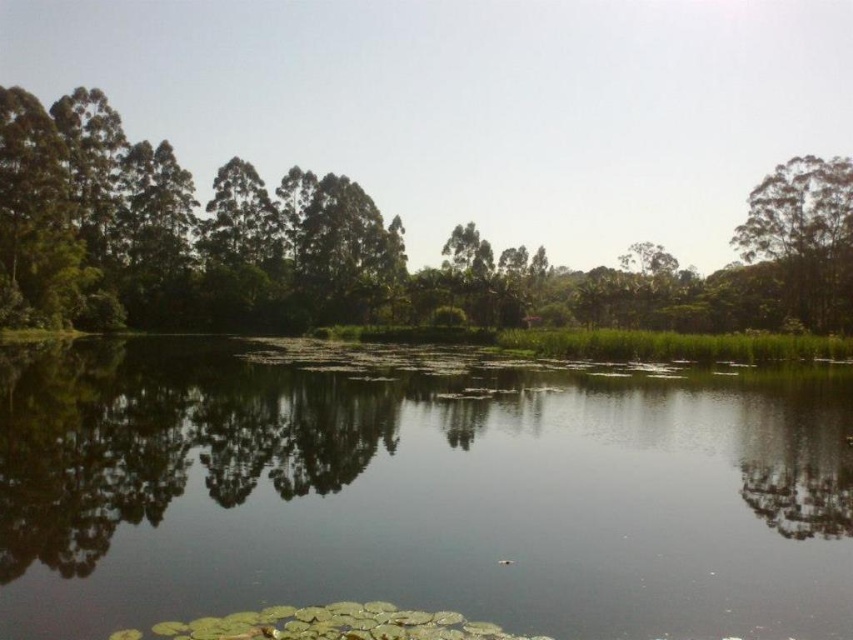
You are standing at the edge of the water and want to place a small floating decoration exactly at the center of the green leafy water at center. According to the coordinates provided, what are the coordinates where you should place it?

The coordinates for placing the small floating decoration at the center of the green leafy water at center are exactly at point (419,493).

You are standing in the forest looking at the scene. Which of the two green leafy trees is nearer to you, the green leafy trees at center or the green leafy tree at upper right?

The green leafy trees at center is closer to the viewer than the green leafy tree at upper right.

You are standing at the edge of the pond and see two points marked in the scene. The first point is at coordinates point (399, 385) and the second is at point (808, 180). Which point is closer to you?

Point (399, 385) is in front of point (808, 180), so it is closer to you.